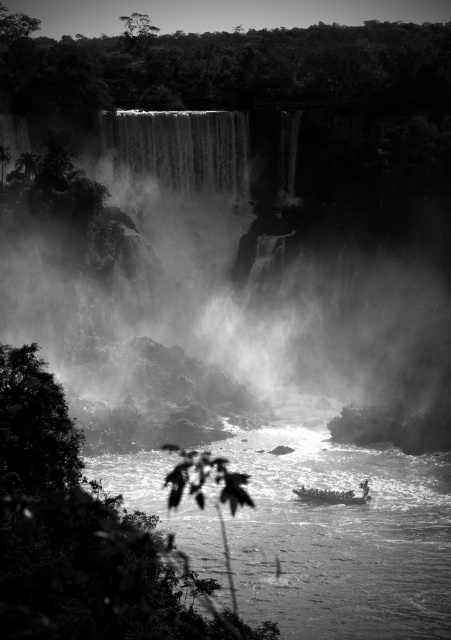
Question: Which point is farther to the camera?

Choices:
 (A) (345, 490)
 (B) (358, 237)
 (C) (326, 548)

Answer: (B)

Question: Is foggy mist at center bigger than wooden boat at center?

Choices:
 (A) yes
 (B) no

Answer: (A)

Question: Which of the following is the closest to the observer?

Choices:
 (A) 280,621
 (B) 362,493
 (C) 317,273

Answer: (A)

Question: Is smooth water at lower center closer to the viewer compared to wooden boat at center?

Choices:
 (A) no
 (B) yes

Answer: (B)

Question: Is smooth water at lower center below wooden boat at center?

Choices:
 (A) yes
 (B) no

Answer: (A)

Question: Which point appears closest to the camera in this image?

Choices:
 (A) (358, 497)
 (B) (382, 451)
 (C) (433, 416)

Answer: (A)